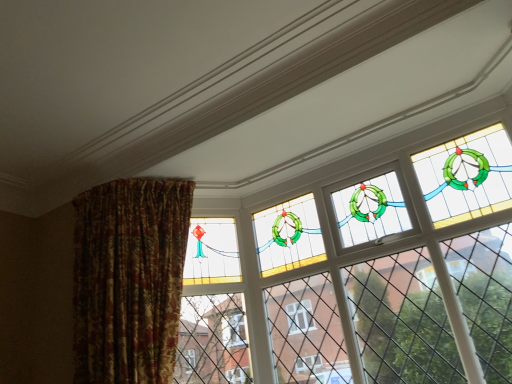
Question: Considering the positions of point (142, 316) and point (289, 266), is point (142, 316) closer or farther from the camera than point (289, 266)?

Choices:
 (A) closer
 (B) farther

Answer: (A)

Question: Based on their sizes in the image, would you say floral fabric curtain at left is bigger or smaller than stained glass window at upper center?

Choices:
 (A) small
 (B) big

Answer: (B)

Question: Is floral fabric curtain at left inside the boundaries of stained glass window at upper center, or outside?

Choices:
 (A) outside
 (B) inside

Answer: (A)

Question: Relative to floral fabric curtain at left, is stained glass window at upper center in front or behind?

Choices:
 (A) behind
 (B) front

Answer: (B)

Question: Considering the positions of stained glass window at upper center and floral fabric curtain at left in the image, is stained glass window at upper center bigger or smaller than floral fabric curtain at left?

Choices:
 (A) small
 (B) big

Answer: (A)

Question: From a real-world perspective, is stained glass window at upper center positioned above or below floral fabric curtain at left?

Choices:
 (A) above
 (B) below

Answer: (B)

Question: Considering the positions of stained glass window at upper center and floral fabric curtain at left in the image, is stained glass window at upper center wider or thinner than floral fabric curtain at left?

Choices:
 (A) wide
 (B) thin

Answer: (B)